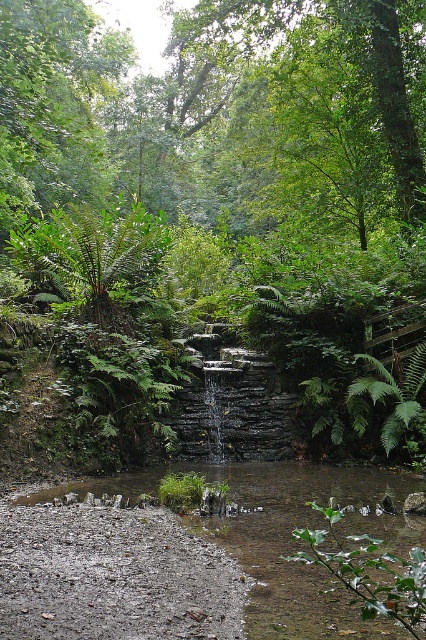
Question: Which point is farther to the camera?

Choices:
 (A) (394, 33)
 (B) (374, 394)

Answer: (A)

Question: Does green leafy tree at upper center come behind clear water at center?

Choices:
 (A) no
 (B) yes

Answer: (B)

Question: Which point is farther to the camera?

Choices:
 (A) (423, 369)
 (B) (258, 592)
 (C) (393, 580)
 (D) (66, 220)

Answer: (D)

Question: Can you confirm if green leafy tree at upper center is positioned above green leafy fern at upper left?

Choices:
 (A) yes
 (B) no

Answer: (A)

Question: Estimate the real-world distances between objects in this image. Which object is farther from the clear water at center?

Choices:
 (A) green leafy fern at lower center
 (B) green leafy fern at upper left
 (C) green leafy fern at center

Answer: (B)

Question: Is green leafy tree at upper center positioned at the back of green leafy fern at lower center?

Choices:
 (A) yes
 (B) no

Answer: (A)